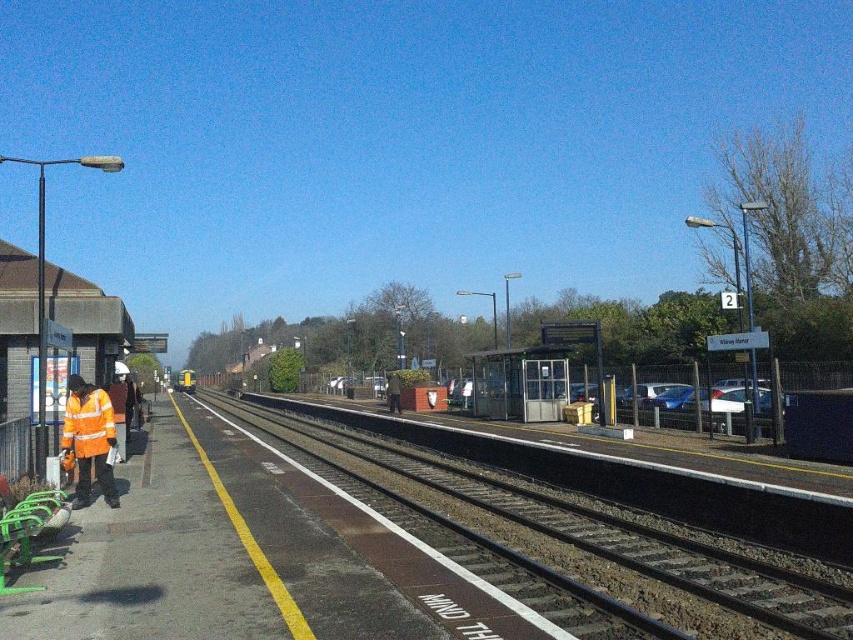
You are standing on the railway station platform and want to reach a specific point marked as point (97, 417). If you can walk 1.5 meters per second, how many seconds will it take you to reach that point?

The point (97, 417) is 10.89 meters from viewer. At a walking speed of 1.5 meters per second, it will take approximately 7.26 seconds to reach the point.

Based on the scene description, what are the coordinates of the black asphalt track at center?

The coordinates of the black asphalt track at center are at point (573, 531).